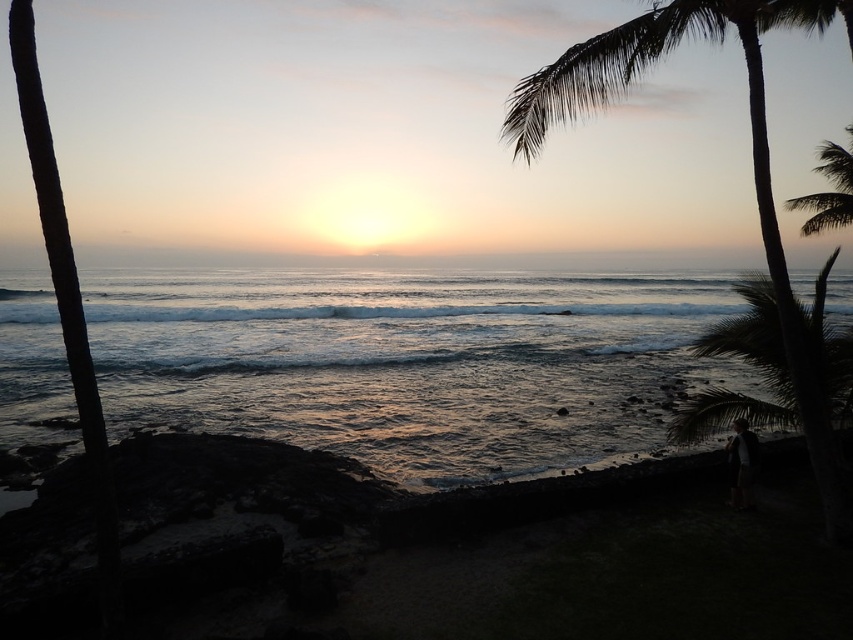
You are standing on the beach and want to take a photo of the sunset. You have a camera that can only capture objects within a 100cm width. The green leafy palm tree at right and the smooth ocean at center are both in your view. Considering their sizes, can you fit both into the photo without cropping either?

The green leafy palm tree at right is bigger than the smooth ocean at center. Since the camera can only capture up to 100cm width, and the palm tree is larger, it might block part of the ocean. Therefore, you might not be able to fit both without cropping.

You are standing on the rocky shoreline and see the point marked at coordinates (x=409, y=360). Based on the scene description, where is this point located?

The point at (x=409, y=360) is on the shiny blue water at center.